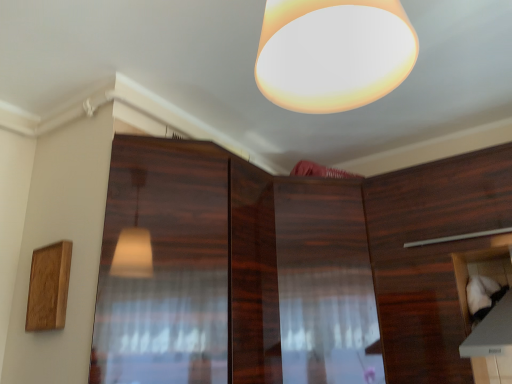
The height and width of the screenshot is (384, 512). What do you see at coordinates (429, 256) in the screenshot?
I see `wooden cabinet at right, which ranks as the second cabinetry in right-to-left order` at bounding box center [429, 256].

Describe the element at coordinates (333, 53) in the screenshot. This screenshot has height=384, width=512. I see `matte white lampshade at upper center` at that location.

What do you see at coordinates (481, 271) in the screenshot?
I see `white fabric at lower right, arranged as the 3th cabinetry when viewed from the left` at bounding box center [481, 271].

Find the location of `wooden cabinet at right, which ranks as the second cabinetry in left-to-right order`. wooden cabinet at right, which ranks as the second cabinetry in left-to-right order is located at coordinates (429, 256).

Between wooden cabinet at right, which ranks as the second cabinetry in right-to-left order, and wooden cabinet at center, arranged as the 3th cabinetry when viewed from the right, which one has smaller size?

Smaller between the two is wooden cabinet at right, which ranks as the second cabinetry in right-to-left order.

Does point (444, 223) lie in front of point (346, 356)?

No, it is not.

The width and height of the screenshot is (512, 384). In order to click on cabinetry located behind the wooden cabinet at right, which ranks as the second cabinetry in right-to-left order in this screenshot , I will do `click(325, 286)`.

From their relative heights in the image, would you say wooden cabinet at right, which ranks as the second cabinetry in right-to-left order, is taller or shorter than wooden cabinet at center, arranged as the 3th cabinetry when viewed from the right?

In the image, wooden cabinet at right, which ranks as the second cabinetry in right-to-left order, appears to be shorter than wooden cabinet at center, arranged as the 3th cabinetry when viewed from the right.

From a real-world perspective, is white fabric at lower right, the 1th cabinetry from the right, positioned over wooden cabinet at right, which ranks as the second cabinetry in right-to-left order, based on gravity?

No.

Is white fabric at lower right, the 1th cabinetry from the right, inside the boundaries of wooden cabinet at right, which ranks as the second cabinetry in left-to-right order, or outside?

white fabric at lower right, the 1th cabinetry from the right, is inside wooden cabinet at right, which ranks as the second cabinetry in left-to-right order.

From the image's perspective, is white fabric at lower right, arranged as the 3th cabinetry when viewed from the left, located beneath wooden cabinet at right, which ranks as the second cabinetry in right-to-left order?

Indeed, from the image's perspective, white fabric at lower right, arranged as the 3th cabinetry when viewed from the left, is shown beneath wooden cabinet at right, which ranks as the second cabinetry in right-to-left order.

Between white fabric at lower right, the 1th cabinetry from the right, and wooden cabinet at right, which ranks as the second cabinetry in left-to-right order, which one has less height?

white fabric at lower right, the 1th cabinetry from the right, is shorter.

Can you confirm if wooden cabinet at center, which ranks as the 1th cabinetry in left-to-right order, is wider than glossy wood screen door at center?

Yes.

From a real-world perspective, which is physically below, wooden cabinet at center, arranged as the 3th cabinetry when viewed from the right, or glossy wood screen door at center?

wooden cabinet at center, arranged as the 3th cabinetry when viewed from the right, is physically lower.

Is wooden cabinet at center, which ranks as the 1th cabinetry in left-to-right order, at the right side of glossy wood screen door at center?

Yes.

Is wooden cabinet at center, arranged as the 3th cabinetry when viewed from the right, bigger than glossy wood screen door at center?

Yes, wooden cabinet at center, arranged as the 3th cabinetry when viewed from the right, is bigger than glossy wood screen door at center.

From a real-world perspective, between wooden cabinet at center, arranged as the 3th cabinetry when viewed from the right, and white fabric at lower right, arranged as the 3th cabinetry when viewed from the left, who is vertically higher?

From a 3D spatial view, wooden cabinet at center, arranged as the 3th cabinetry when viewed from the right, is above.

What's the angular difference between wooden cabinet at center, which ranks as the 1th cabinetry in left-to-right order, and white fabric at lower right, arranged as the 3th cabinetry when viewed from the left,'s facing directions?

The angular difference between wooden cabinet at center, which ranks as the 1th cabinetry in left-to-right order, and white fabric at lower right, arranged as the 3th cabinetry when viewed from the left, is 44.8 degrees.

Is wooden cabinet at center, which ranks as the 1th cabinetry in left-to-right order, in front of white fabric at lower right, the 1th cabinetry from the right?

That is False.

Is glossy wood screen door at center taller or shorter than wooden cabinet at right, which ranks as the second cabinetry in right-to-left order?

Considering their sizes, glossy wood screen door at center has less height than wooden cabinet at right, which ranks as the second cabinetry in right-to-left order.

Is glossy wood screen door at center bigger or smaller than wooden cabinet at right, which ranks as the second cabinetry in left-to-right order?

Clearly, glossy wood screen door at center is smaller in size than wooden cabinet at right, which ranks as the second cabinetry in left-to-right order.

Would you consider glossy wood screen door at center to be distant from wooden cabinet at right, which ranks as the second cabinetry in left-to-right order?

No, there isn't a large distance between glossy wood screen door at center and wooden cabinet at right, which ranks as the second cabinetry in left-to-right order.

Considering the points (188, 297) and (379, 278), which point is behind, point (188, 297) or point (379, 278)?

The point (379, 278) is farther from the camera.

Is white fabric at lower right, the 1th cabinetry from the right, completely or partially inside matte white lampshade at upper center?

No, white fabric at lower right, the 1th cabinetry from the right, is not a part of matte white lampshade at upper center.

Could you tell me if matte white lampshade at upper center is turned towards white fabric at lower right, arranged as the 3th cabinetry when viewed from the left?

Yes, matte white lampshade at upper center is facing white fabric at lower right, arranged as the 3th cabinetry when viewed from the left.

You are a GUI agent. You are given a task and a screenshot of the screen. Output one action in this format:
    pyautogui.click(x=<x>, y=<y>)
    Task: Click on the lamp lying in front of the white fabric at lower right, the 1th cabinetry from the right
    
    Given the screenshot: What is the action you would take?
    pyautogui.click(x=333, y=53)

Is matte white lampshade at upper center in contact with white fabric at lower right, arranged as the 3th cabinetry when viewed from the left?

matte white lampshade at upper center and white fabric at lower right, arranged as the 3th cabinetry when viewed from the left, are not in contact.

What's the angular difference between wooden cabinet at center, arranged as the 3th cabinetry when viewed from the right, and wooden cabinet at right, which ranks as the second cabinetry in right-to-left order,'s facing directions?

44.9 degrees separate the facing orientations of wooden cabinet at center, arranged as the 3th cabinetry when viewed from the right, and wooden cabinet at right, which ranks as the second cabinetry in right-to-left order.

Is wooden cabinet at right, which ranks as the second cabinetry in left-to-right order, completely or partially inside wooden cabinet at center, arranged as the 3th cabinetry when viewed from the right?

Actually, wooden cabinet at right, which ranks as the second cabinetry in left-to-right order, is outside wooden cabinet at center, arranged as the 3th cabinetry when viewed from the right.

From the image's perspective, who appears lower, wooden cabinet at center, arranged as the 3th cabinetry when viewed from the right, or wooden cabinet at right, which ranks as the second cabinetry in right-to-left order?

wooden cabinet at center, arranged as the 3th cabinetry when viewed from the right.

Is wooden cabinet at center, arranged as the 3th cabinetry when viewed from the right, aimed at wooden cabinet at right, which ranks as the second cabinetry in right-to-left order?

No, wooden cabinet at center, arranged as the 3th cabinetry when viewed from the right, is not aimed at wooden cabinet at right, which ranks as the second cabinetry in right-to-left order.

Identify the location of cabinetry behind the wooden cabinet at right, which ranks as the second cabinetry in left-to-right order. (325, 286).

Where is `the 2nd cabinetry positioned above the white fabric at lower right, arranged as the 3th cabinetry when viewed from the left (from a real-world perspective)`? The height and width of the screenshot is (384, 512). the 2nd cabinetry positioned above the white fabric at lower right, arranged as the 3th cabinetry when viewed from the left (from a real-world perspective) is located at coordinates (429, 256).

When comparing their distances from matte white lampshade at upper center, does white fabric at lower right, the 1th cabinetry from the right, or wooden cabinet at right, which ranks as the second cabinetry in right-to-left order, seem further?

Among the two, wooden cabinet at right, which ranks as the second cabinetry in right-to-left order, is located further to matte white lampshade at upper center.

Considering their positions, is matte white lampshade at upper center positioned closer to wooden cabinet at center, which ranks as the 1th cabinetry in left-to-right order, than glossy wood screen door at center?

Among the two, glossy wood screen door at center is located nearer to wooden cabinet at center, which ranks as the 1th cabinetry in left-to-right order.

Which object lies further to the anchor point glossy wood screen door at center, matte white lampshade at upper center or wooden cabinet at right, which ranks as the second cabinetry in left-to-right order?

wooden cabinet at right, which ranks as the second cabinetry in left-to-right order, is positioned further to the anchor glossy wood screen door at center.

Estimate the real-world distances between objects in this image. Which object is further from wooden cabinet at right, which ranks as the second cabinetry in right-to-left order, white fabric at lower right, arranged as the 3th cabinetry when viewed from the left, or glossy wood screen door at center?

Based on the image, glossy wood screen door at center appears to be further to wooden cabinet at right, which ranks as the second cabinetry in right-to-left order.

Looking at the image, which one is located further to white fabric at lower right, arranged as the 3th cabinetry when viewed from the left, wooden cabinet at center, which ranks as the 1th cabinetry in left-to-right order, or matte white lampshade at upper center?

matte white lampshade at upper center is further to white fabric at lower right, arranged as the 3th cabinetry when viewed from the left.

Which object lies nearer to the anchor point white fabric at lower right, arranged as the 3th cabinetry when viewed from the left, glossy wood screen door at center or wooden cabinet at right, which ranks as the second cabinetry in right-to-left order?

Based on the image, wooden cabinet at right, which ranks as the second cabinetry in right-to-left order, appears to be nearer to white fabric at lower right, arranged as the 3th cabinetry when viewed from the left.

Based on their spatial positions, is wooden cabinet at right, which ranks as the second cabinetry in right-to-left order, or white fabric at lower right, arranged as the 3th cabinetry when viewed from the left, closer to glossy wood screen door at center?

wooden cabinet at right, which ranks as the second cabinetry in right-to-left order.

Considering their positions, is matte white lampshade at upper center positioned further to wooden cabinet at center, which ranks as the 1th cabinetry in left-to-right order, than wooden cabinet at right, which ranks as the second cabinetry in left-to-right order?

matte white lampshade at upper center lies further to wooden cabinet at center, which ranks as the 1th cabinetry in left-to-right order, than the other object.

Find the location of a particular element. The image size is (512, 384). cabinetry between matte white lampshade at upper center and wooden cabinet at right, which ranks as the second cabinetry in right-to-left order, in the front-back direction is located at coordinates (481, 271).

I want to click on cabinetry between glossy wood screen door at center and wooden cabinet at right, which ranks as the second cabinetry in right-to-left order, in the horizontal direction, so coord(325,286).

I want to click on lamp located between glossy wood screen door at center and white fabric at lower right, arranged as the 3th cabinetry when viewed from the left, in the left-right direction, so click(x=333, y=53).

Locate an element on the screen. screen door between matte white lampshade at upper center and wooden cabinet at center, which ranks as the 1th cabinetry in left-to-right order, along the z-axis is located at coordinates (163, 266).